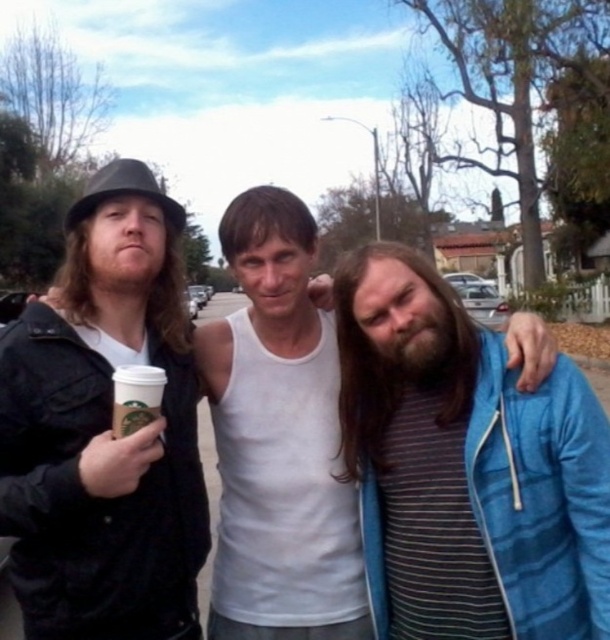
Does black matte hat at upper left have a lesser height compared to white paper cup at center?

In fact, black matte hat at upper left may be taller than white paper cup at center.

Does black matte hat at upper left have a smaller size compared to white paper cup at center?

Incorrect, black matte hat at upper left is not smaller in size than white paper cup at center.

Where is `black matte hat at upper left`? The width and height of the screenshot is (610, 640). black matte hat at upper left is located at coordinates (104, 429).

Locate an element on the screen. Image resolution: width=610 pixels, height=640 pixels. black matte hat at upper left is located at coordinates (104, 429).

Is striped cotton shirt at center to the right of white paper cup at center from the viewer's perspective?

Yes, striped cotton shirt at center is to the right of white paper cup at center.

Does striped cotton shirt at center have a greater height compared to white paper cup at center?

Indeed, striped cotton shirt at center has a greater height compared to white paper cup at center.

This screenshot has width=610, height=640. Describe the element at coordinates (467, 468) in the screenshot. I see `striped cotton shirt at center` at that location.

The height and width of the screenshot is (640, 610). In order to click on striped cotton shirt at center in this screenshot , I will do `click(467, 468)`.

Does striped cotton shirt at center appear over white cotton tank top at center?

Actually, striped cotton shirt at center is below white cotton tank top at center.

Who is more distant from viewer, (542, 627) or (262, 380)?

Point (262, 380)

This screenshot has height=640, width=610. Find the location of `striped cotton shirt at center`. striped cotton shirt at center is located at coordinates (467, 468).